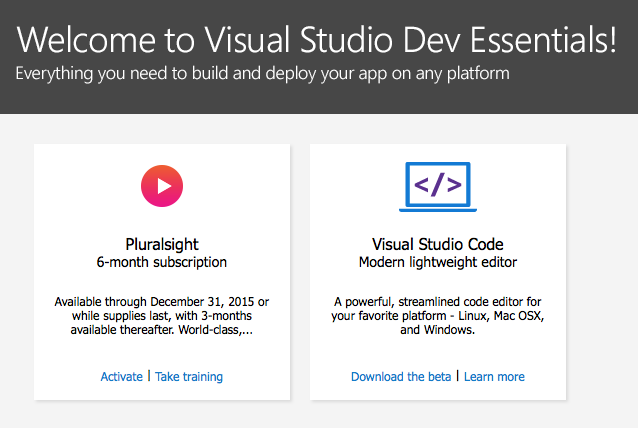
At what (x,y) coordinates should I click in order to perform the action: click on separators. Please return your answer as a coordinate pair (x, y). The height and width of the screenshot is (428, 638). Looking at the image, I should click on (456, 375), (149, 375).